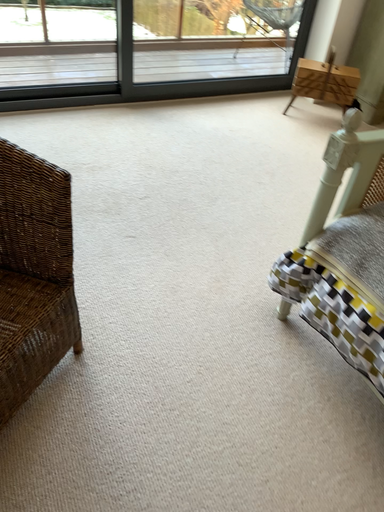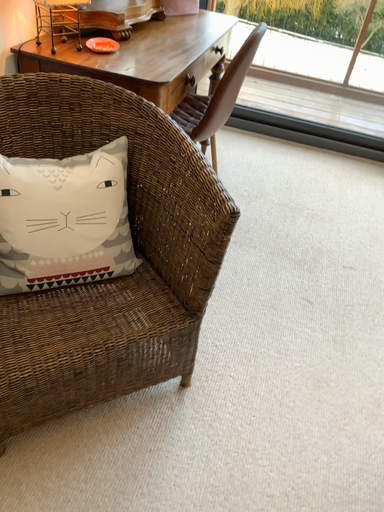
Question: How did the camera likely rotate when shooting the video?

Choices:
 (A) rotated left
 (B) rotated right

Answer: (A)